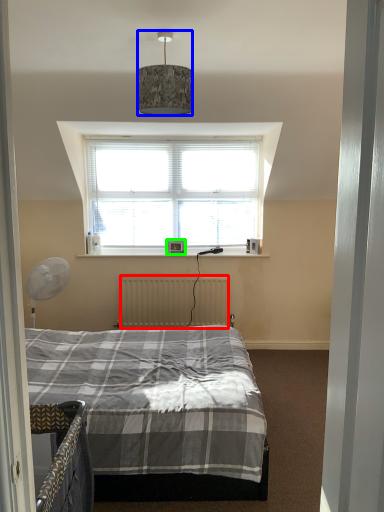
Question: Based on their relative distances, which object is nearer to radiator (highlighted by a red box)? Choose from lamp (highlighted by a blue box) and picture frame (highlighted by a green box).

Choices:
 (A) lamp
 (B) picture frame

Answer: (B)